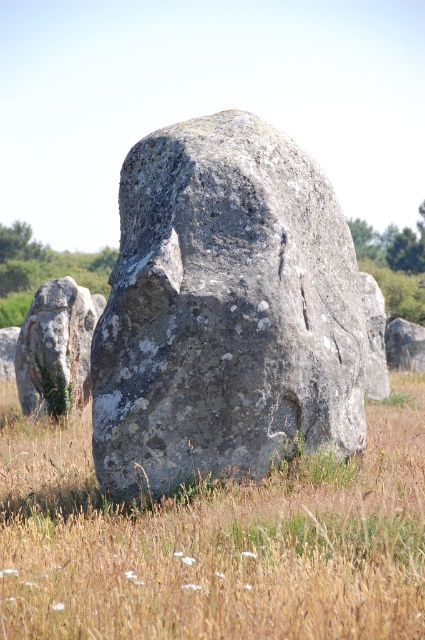
You are an archaeologist examining the megalithic site. You notice the gray rough stone at center and the smooth gray rock at left. Which object would you need to move first if you want to access the smaller one?

The gray rough stone at center is larger than the smooth gray rock at left, so you would need to move the gray rough stone at center first to access the smaller smooth gray rock at left.

You are standing in the grassy field and want to find the gray rough stone at center. According to the coordinates provided, where should you look relative to your position?

The gray rough stone at center is located at coordinates approximately 0.486 on the x and 0.529 on the y axis, which places it near the center of the field.

You are an archaeologist examining the megalithic site. You notice two gray stones at the center of the field. The first is labeled as the gray rough stone at center, and the second is the gray stone at center. Which of these two stones is bigger?

The gray rough stone at center is larger in size compared to the gray stone at center according to the description provided.